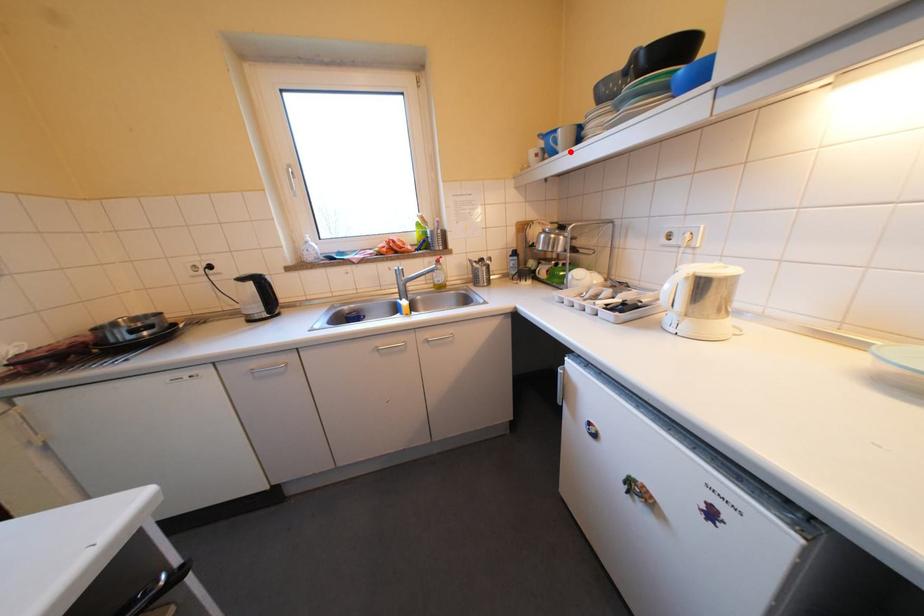
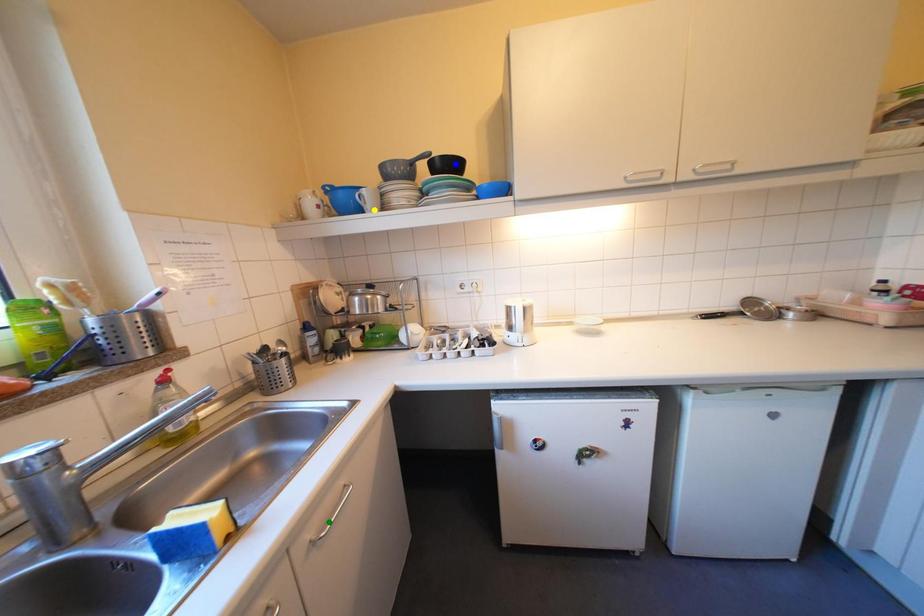
Question: I am providing you with two images of the same scene from different viewpoints. A red point is marked on the first image. You are given multiple points on the second image. Which spot in image 2 lines up with the point in image 1?

Choices:
 (A) blue point
 (B) yellow point
 (C) green point

Answer: (B)